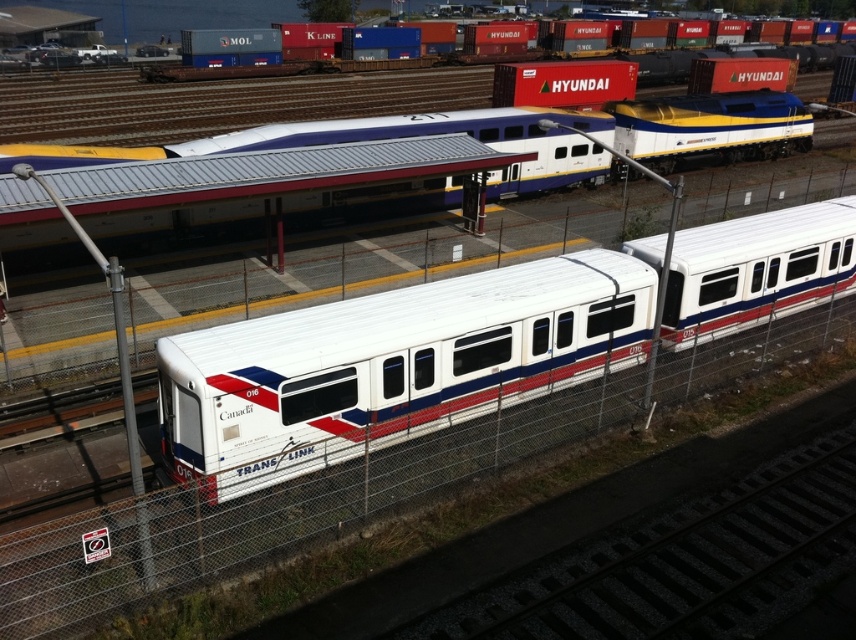
You are standing at the center of the railway yard. You see a white glossy passenger train at center represented by point (395, 364). Can you determine the exact coordinates of the white glossy passenger train at center?

The white glossy passenger train at center is represented by point (395, 364).

You are standing in the railway yard and want to take a photo of the white glossy passenger train at center and the white glossy train at center. Which one should you focus on first if you want the closer one to be in sharp focus?

The white glossy passenger train at center is closer to the viewer than the white glossy train at center, so you should focus on the white glossy passenger train at center first to ensure it is in sharp focus.

You are a railway engineer assessing the layout of the yard. You need to determine which of the two trains, the white glossy train at center or the matte white train at upper center, requires more space for storage. Based on the scene, which one should you allocate more space for?

The matte white train at upper center requires more space for storage because it occupies more space than the white glossy train at center.